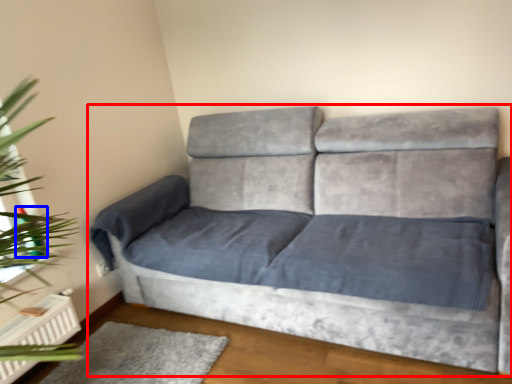
Question: Which of the following is the closest to the observer, studio couch (highlighted by a red box) or teal (highlighted by a blue box)?

Choices:
 (A) studio couch
 (B) teal

Answer: (A)